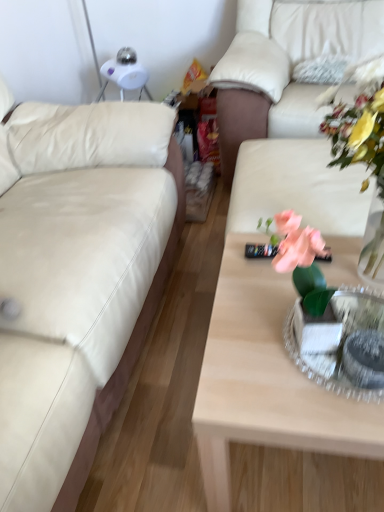
Question: Is white textured pillow at upper right facing away from metallic silver tray at center?

Choices:
 (A) no
 (B) yes

Answer: (A)

Question: Is white textured pillow at upper right not near metallic silver tray at center?

Choices:
 (A) yes
 (B) no

Answer: (A)

Question: Is white textured pillow at upper right to the left of metallic silver tray at center from the viewer's perspective?

Choices:
 (A) no
 (B) yes

Answer: (A)

Question: Can you confirm if white textured pillow at upper right is shorter than metallic silver tray at center?

Choices:
 (A) yes
 (B) no

Answer: (B)

Question: From a real-world perspective, is white textured pillow at upper right located beneath metallic silver tray at center?

Choices:
 (A) yes
 (B) no

Answer: (B)

Question: Is white textured pillow at upper right facing towards metallic silver tray at center?

Choices:
 (A) no
 (B) yes

Answer: (B)

Question: From a real-world perspective, does beige leather couch at left, the 2th studio couch from the right, sit lower than translucent glass vase at upper right?

Choices:
 (A) no
 (B) yes

Answer: (B)

Question: From the image's perspective, is beige leather couch at left, the 2th studio couch from the right, above translucent glass vase at upper right?

Choices:
 (A) yes
 (B) no

Answer: (A)

Question: Can you confirm if beige leather couch at left, the 2th studio couch from the right, is wider than translucent glass vase at upper right?

Choices:
 (A) yes
 (B) no

Answer: (A)

Question: Does beige leather couch at left, the 1th studio couch from the left, appear on the right side of translucent glass vase at upper right?

Choices:
 (A) no
 (B) yes

Answer: (A)

Question: Is beige leather couch at left, the 1th studio couch from the left, smaller than translucent glass vase at upper right?

Choices:
 (A) no
 (B) yes

Answer: (A)

Question: From the image's perspective, is beige leather couch at left, the 2th studio couch from the right, under translucent glass vase at upper right?

Choices:
 (A) yes
 (B) no

Answer: (B)

Question: Is white leather couch at upper right, which appears as the first studio couch when viewed from the right, thinner than light wood coffee table at center?

Choices:
 (A) no
 (B) yes

Answer: (A)